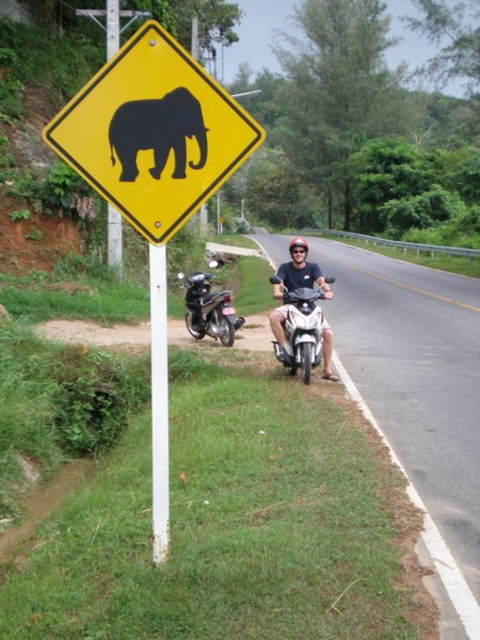
Is yellow plastic diamond-shaped sign with elephant silhouette at left behind silver metallic scooter at center?

No, yellow plastic diamond-shaped sign with elephant silhouette at left is closer to the viewer.

Does yellow plastic diamond-shaped sign with elephant silhouette at left have a smaller size compared to silver metallic scooter at center?

Yes.

Locate an element on the screen. The image size is (480, 640). yellow plastic diamond-shaped sign with elephant silhouette at left is located at coordinates (154, 179).

Who is higher up, yellow plastic elephant at upper left or metallic silver scooter at lower left?

metallic silver scooter at lower left is above.

Does yellow plastic elephant at upper left have a lesser width compared to metallic silver scooter at lower left?

Yes, yellow plastic elephant at upper left is thinner than metallic silver scooter at lower left.

I want to click on yellow plastic elephant at upper left, so coord(154,132).

Locate an element on the screen. yellow plastic elephant at upper left is located at coordinates coord(154,132).

Does yellow plastic elephant at upper left have a greater height compared to black matte elephant at upper left?

Yes.

Does yellow plastic elephant at upper left have a lesser height compared to black matte elephant at upper left?

In fact, yellow plastic elephant at upper left may be taller than black matte elephant at upper left.

Does point (165, 216) come behind point (119, 154)?

Yes, it is.

Where is `yellow plastic elephant at upper left`? This screenshot has width=480, height=640. yellow plastic elephant at upper left is located at coordinates (154, 132).